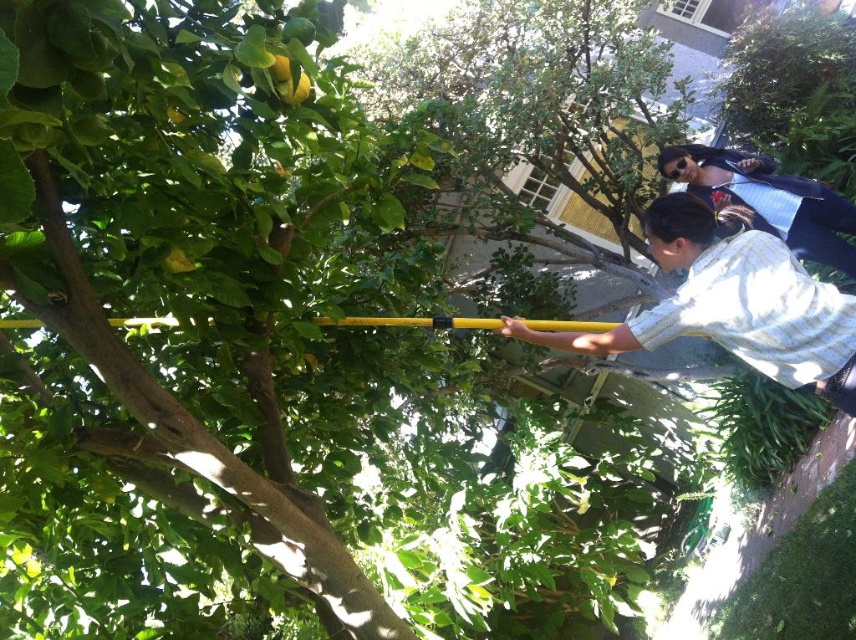
You are standing in the orchard and see the yellow matte pole at upper right and the denim jacket at upper right. Which object is nearer to you?

The yellow matte pole at upper right is closer to the viewer than the denim jacket at upper right, so the yellow matte pole at upper right is nearer to you.

You are standing in front of the citrus tree and want to pick a fruit located at point A. There is a yellow matte pole at upper right. Can you reach the fruit with the pole?

The yellow matte pole at upper right is located at point (x=733, y=301), so if the fruit at point A is within the pole reach, then yes. However, without knowing the exact position of the fruit, it is impossible to determine.